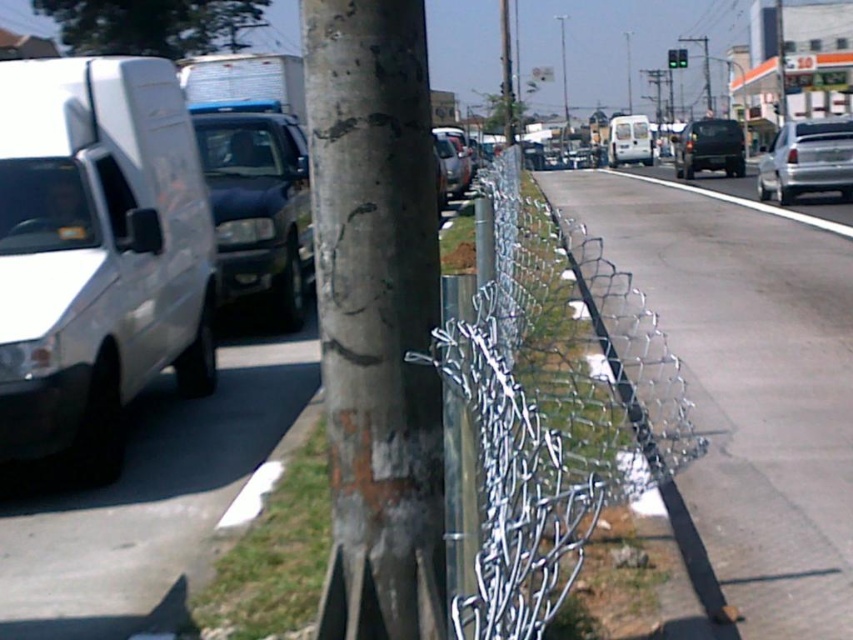
Does metallic chain-link fence at center come behind white matte van at left?

No, it is not.

Which is above, metallic chain-link fence at center or white matte van at left?

metallic chain-link fence at center is higher up.

Locate an element on the screen. Image resolution: width=853 pixels, height=640 pixels. metallic chain-link fence at center is located at coordinates (746, 394).

Between point (535, 532) and point (577, 177), which one is positioned in front?

Point (535, 532) is in front.

Which is behind, point (653, 333) or point (798, 337)?

The point (653, 333) is more distant.

Measure the distance between point [515,616] and camera.

3.90 feet

Identify the location of metallic chain-link fence at center-right. The image size is (853, 640). (550, 420).

Can you confirm if metallic chain-link fence at center-right is positioned above white glossy truck at upper right?

No.

Between metallic chain-link fence at center-right and white glossy truck at upper right, which one appears on the right side from the viewer's perspective?

white glossy truck at upper right is more to the right.

Locate an element on the screen. The height and width of the screenshot is (640, 853). metallic chain-link fence at center-right is located at coordinates click(x=550, y=420).